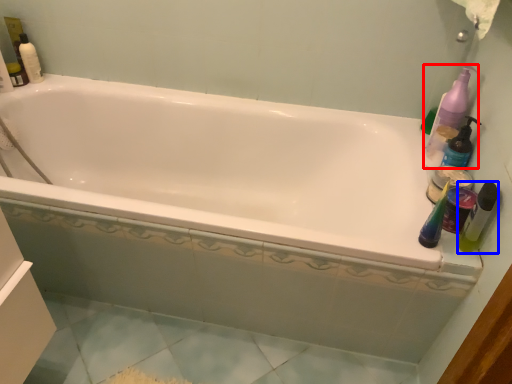
Question: Which object appears farthest to the camera in this image, cleaning product (highlighted by a red box) or mouthwash (highlighted by a blue box)?

Choices:
 (A) cleaning product
 (B) mouthwash

Answer: (A)